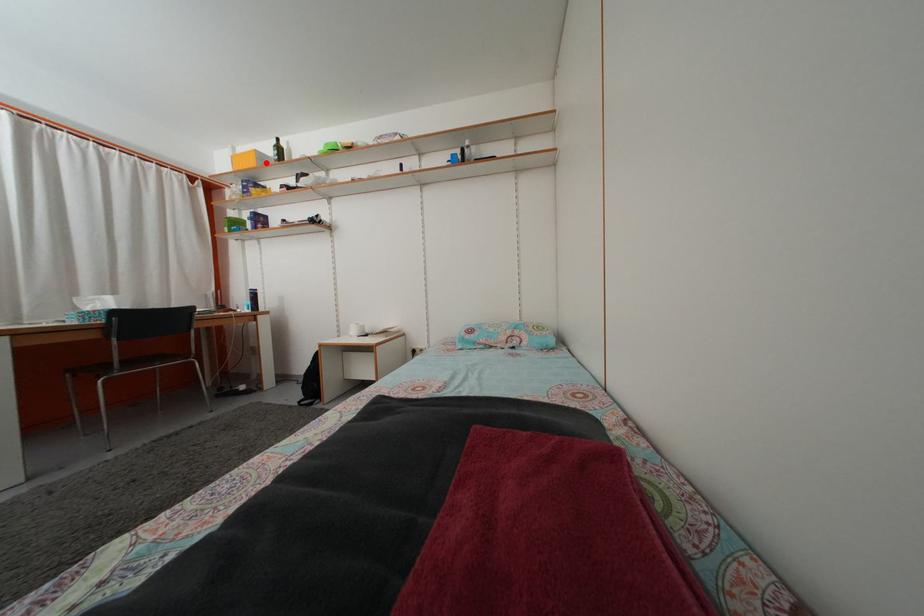
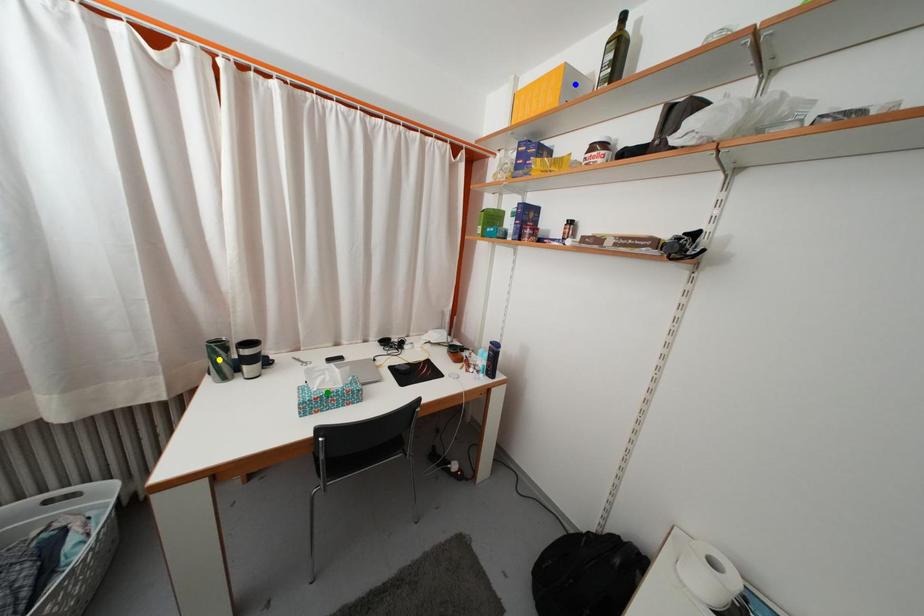
Question: I am providing you with two images of the same scene from different viewpoints. A red point is marked on the first image. You are given multiple points on the second image. In image 2, which mark is for the same physical point as the one in image 1?

Choices:
 (A) yellow point
 (B) green point
 (C) blue point

Answer: (C)